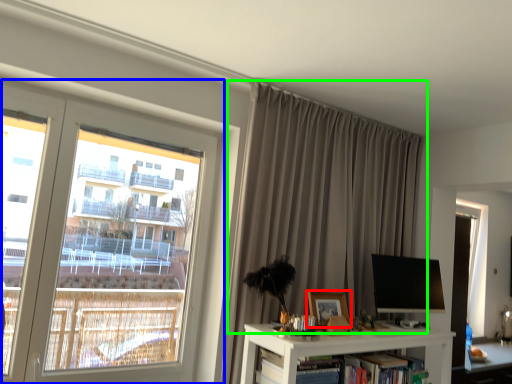
Question: Which object is the closest to the picture frame (highlighted by a red box)? Choose among these: window (highlighted by a blue box) or curtain (highlighted by a green box).

Choices:
 (A) window
 (B) curtain

Answer: (B)